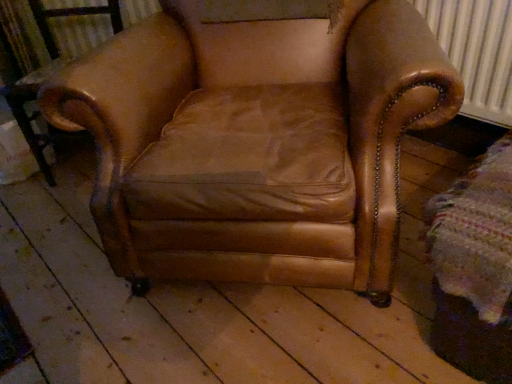
Question: Should I look upward or downward to see metallic black side table at left?

Choices:
 (A) up
 (B) down

Answer: (A)

Question: From a real-world perspective, is leather armchair at center under metallic black side table at left?

Choices:
 (A) yes
 (B) no

Answer: (B)

Question: Is leather armchair at center further to the viewer compared to metallic black side table at left?

Choices:
 (A) yes
 (B) no

Answer: (B)

Question: From a real-world perspective, is leather armchair at center positioned over metallic black side table at left based on gravity?

Choices:
 (A) yes
 (B) no

Answer: (A)

Question: Is leather armchair at center far from metallic black side table at left?

Choices:
 (A) yes
 (B) no

Answer: (B)

Question: From the image's perspective, is leather armchair at center located beneath metallic black side table at left?

Choices:
 (A) no
 (B) yes

Answer: (A)

Question: Can metallic black side table at left be found inside leather armchair at center?

Choices:
 (A) no
 (B) yes

Answer: (A)

Question: From the image's perspective, is metallic black side table at left on top of leather armchair at center?

Choices:
 (A) no
 (B) yes

Answer: (A)

Question: Is metallic black side table at left wider than leather armchair at center?

Choices:
 (A) yes
 (B) no

Answer: (B)

Question: Could you tell me if metallic black side table at left is facing leather armchair at center?

Choices:
 (A) yes
 (B) no

Answer: (B)

Question: Is metallic black side table at left in front of leather armchair at center?

Choices:
 (A) yes
 (B) no

Answer: (B)

Question: From a real-world perspective, is metallic black side table at left located higher than leather armchair at center?

Choices:
 (A) yes
 (B) no

Answer: (B)

Question: Does metallic black side table at left have a greater height compared to leather armchair at center?

Choices:
 (A) no
 (B) yes

Answer: (A)

Question: Considering the positions of leather armchair at center and metallic black side table at left in the image, is leather armchair at center taller or shorter than metallic black side table at left?

Choices:
 (A) short
 (B) tall

Answer: (B)